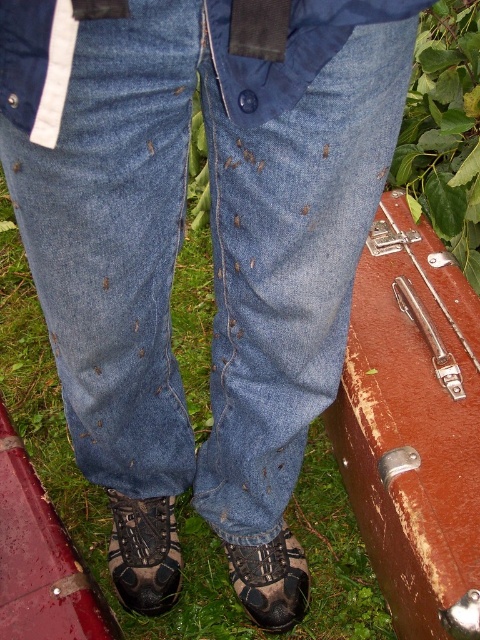
Question: Can you confirm if denim at center is positioned to the left of brown leather boot at lower left?

Choices:
 (A) no
 (B) yes

Answer: (A)

Question: From the image, what is the correct spatial relationship of rusty leather suitcase at center right in relation to brown leather boot at lower left?

Choices:
 (A) above
 (B) below

Answer: (A)

Question: Which object is positioned farthest from the denim at center?

Choices:
 (A) brown suede boot at lower center
 (B) rusty leather suitcase at center right
 (C) brown leather boot at lower left

Answer: (A)

Question: Which object is positioned farthest from the brown leather boot at lower left?

Choices:
 (A) rusty leather suitcase at center right
 (B) brown suede boot at lower center
 (C) denim at center

Answer: (A)

Question: Which is nearer to the rusty leather suitcase at center right?

Choices:
 (A) brown suede boot at lower center
 (B) brown leather boot at lower left

Answer: (A)

Question: Is denim at center thinner than brown leather boot at lower left?

Choices:
 (A) no
 (B) yes

Answer: (A)